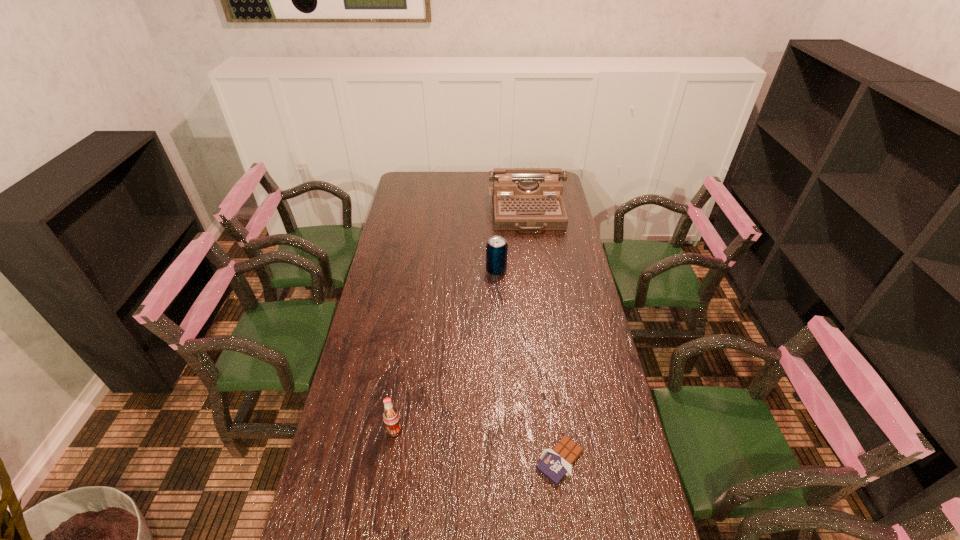
Where is `the tallest object`? the tallest object is located at coordinates (523, 198).

At what (x,y) coordinates should I click in order to perform the action: click on the farthest object. Please return your answer as a coordinate pair (x, y). This screenshot has height=540, width=960. Looking at the image, I should click on (523, 198).

You are a GUI agent. You are given a task and a screenshot of the screen. Output one action in this format:
    pyautogui.click(x=<x>, y=<y>)
    Task: Click on the farther soda
    This screenshot has width=960, height=540.
    Given the screenshot: What is the action you would take?
    pyautogui.click(x=496, y=248)

Identify the location of the second farthest object. The image size is (960, 540). (496, 248).

The image size is (960, 540). What are the coordinates of `the nearer soda` in the screenshot? It's located at (391, 417).

Identify the location of the left soda. The image size is (960, 540). (391, 417).

Image resolution: width=960 pixels, height=540 pixels. Identify the location of the shortest object. (555, 463).

You are a GUI agent. You are given a task and a screenshot of the screen. Output one action in this format:
    pyautogui.click(x=<x>, y=<y>)
    Task: Click on the free space located 0.090m on the keyboard of the typewriter
    The image size is (960, 540).
    Given the screenshot: What is the action you would take?
    [x=532, y=247]

This screenshot has height=540, width=960. I want to click on vacant space positioned on the left of the third nearest object, so click(451, 271).

At what (x,y) coordinates should I click in order to perform the action: click on vacant space located on the front of the nearer soda. Please return your answer as a coordinate pair (x, y). Looking at the image, I should click on (386, 483).